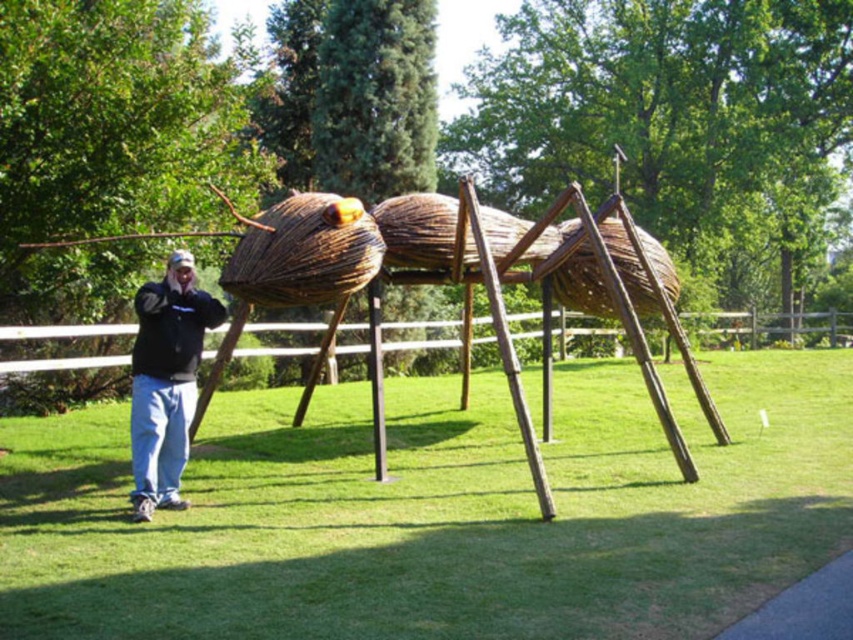
You are a photographer trying to capture the sculpture of the giant ant. You notice the green grass at center and the black fleece jacket at lower left. Which object is closer to the left side of your camera frame?

The black fleece jacket at lower left is closer to the left side of your camera frame because it is positioned to the left of the green grass at center.

You are a photographer trying to capture the entire sculpture and the person in your shot. Given that the black fleece jacket at lower left is smaller than the green grass at center, which object should you focus on to ensure both the sculpture and the person are fully visible in the frame?

Since the green grass at center is larger than the black fleece jacket at lower left, you should focus on the green grass at center to ensure both the sculpture and the person are fully visible in the frame.